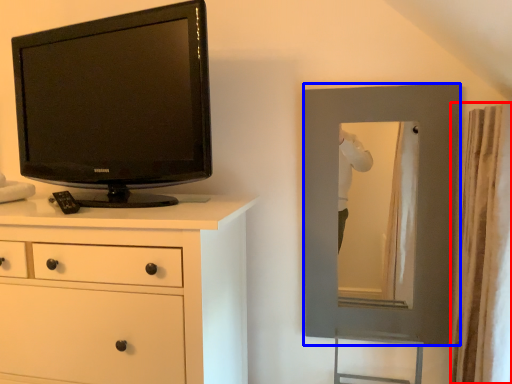
Question: Which object appears farthest to the camera in this image, curtain (highlighted by a red box) or picture frame (highlighted by a blue box)?

Choices:
 (A) curtain
 (B) picture frame

Answer: (B)